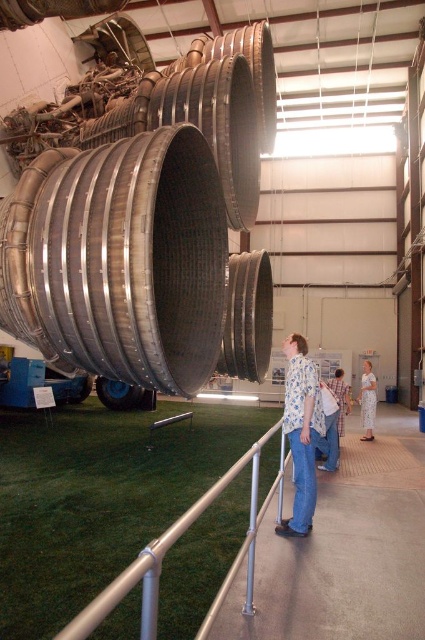
You are standing in the museum and want to take a photo of the rocket engine. You notice the silver metallic rail at center and the white floral dress at center. Which object is closer to the rocket engine?

The silver metallic rail at center is closer to the rocket engine because it is positioned on the left side of the white floral dress at center, which is farther away.

You are a visitor at the museum and want to take a photo of the rocket engine. The silver metallic rail at center is blocking your view. Can you move the rail to get a better shot?

No, you cannot move the silver metallic rail at center because it is part of the exhibit setup and likely fixed in place to ensure safety and preserve the display.

You are a visitor at the museum and want to take a photo of the rocket engine. You are standing behind the silver metallic rail at center. If your camera has a maximum focus range of 35 inches, will you be able to capture the rocket engine clearly?

The silver metallic rail at center is 34.33 inches away from the camera. Since your camera can focus up to 35 inches, you are within range and should be able to capture the rocket engine clearly.